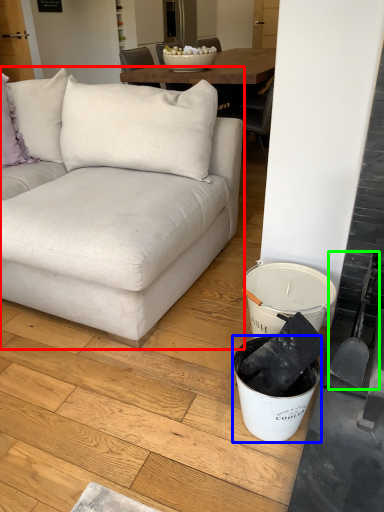
Question: Based on their relative distances, which object is farther from studio couch (highlighted by a red box)? Choose from bucket (highlighted by a blue box) and shovel (highlighted by a green box).

Choices:
 (A) bucket
 (B) shovel

Answer: (B)